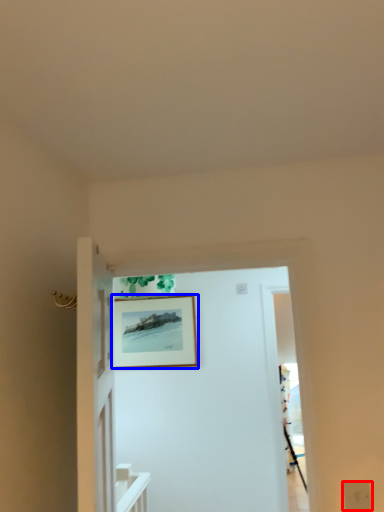
Question: Which object appears closest to the camera in this image, electric outlet (highlighted by a red box) or picture frame (highlighted by a blue box)?

Choices:
 (A) electric outlet
 (B) picture frame

Answer: (A)